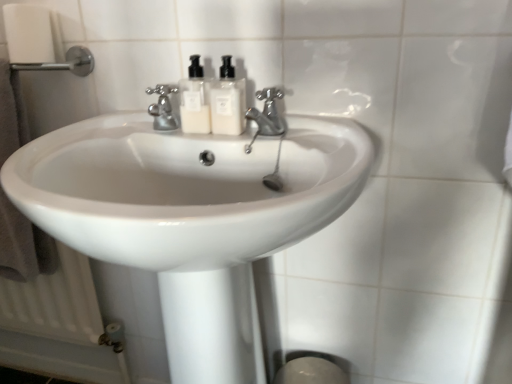
Question: Could satin nickel faucet at center, which appears as the second tap when viewed from the left, be considered to be inside white glossy soap dispenser at center, positioned as the 1th soap dispenser in right-to-left order?

Choices:
 (A) no
 (B) yes

Answer: (A)

Question: Does white glossy soap dispenser at center, which is the second soap dispenser in left-to-right order, have a smaller size compared to satin nickel faucet at center, which appears as the second tap when viewed from the left?

Choices:
 (A) yes
 (B) no

Answer: (A)

Question: From a real-world perspective, is white glossy soap dispenser at center, which is the second soap dispenser in left-to-right order, on satin nickel faucet at center, which is the 1th tap from right to left?

Choices:
 (A) yes
 (B) no

Answer: (A)

Question: Is white glossy soap dispenser at center, positioned as the 1th soap dispenser in right-to-left order, not close to satin nickel faucet at center, which is the 1th tap from right to left?

Choices:
 (A) yes
 (B) no

Answer: (B)

Question: Does white glossy soap dispenser at center, positioned as the 1th soap dispenser in right-to-left order, lie in front of satin nickel faucet at center, which is the 1th tap from right to left?

Choices:
 (A) yes
 (B) no

Answer: (B)

Question: Considering their positions, is polished chrome faucet at center, arranged as the first tap when viewed from the left, located in front of or behind brushed metal towel bar at upper left?

Choices:
 (A) behind
 (B) front

Answer: (B)

Question: From a real-world perspective, is polished chrome faucet at center, arranged as the first tap when viewed from the left, positioned above or below brushed metal towel bar at upper left?

Choices:
 (A) above
 (B) below

Answer: (B)

Question: Looking at the image, does polished chrome faucet at center, which is counted as the 2th tap, starting from the right, seem bigger or smaller compared to brushed metal towel bar at upper left?

Choices:
 (A) small
 (B) big

Answer: (A)

Question: Is polished chrome faucet at center, arranged as the first tap when viewed from the left, situated inside brushed metal towel bar at upper left or outside?

Choices:
 (A) outside
 (B) inside

Answer: (A)

Question: Considering the positions of brown towel at left and white plastic soap dispenser at center, which is the second soap dispenser in right-to-left order, in the image, is brown towel at left taller or shorter than white plastic soap dispenser at center, which is the second soap dispenser in right-to-left order,?

Choices:
 (A) short
 (B) tall

Answer: (B)

Question: Is brown towel at left in front of or behind white plastic soap dispenser at center, which appears as the first soap dispenser when viewed from the left, in the image?

Choices:
 (A) front
 (B) behind

Answer: (B)

Question: Considering the positions of brown towel at left and white plastic soap dispenser at center, which appears as the first soap dispenser when viewed from the left, in the image, is brown towel at left bigger or smaller than white plastic soap dispenser at center, which appears as the first soap dispenser when viewed from the left,?

Choices:
 (A) big
 (B) small

Answer: (A)

Question: Considering the relative positions of brown towel at left and white plastic soap dispenser at center, which is the second soap dispenser in right-to-left order, in the image provided, is brown towel at left to the left or to the right of white plastic soap dispenser at center, which is the second soap dispenser in right-to-left order,?

Choices:
 (A) right
 (B) left

Answer: (B)

Question: Does point (96, 238) appear closer or farther from the camera than point (76, 57)?

Choices:
 (A) closer
 (B) farther

Answer: (A)

Question: From a real-world perspective, is white glossy sink at center physically located above or below brushed metal towel bar at upper left?

Choices:
 (A) above
 (B) below

Answer: (B)